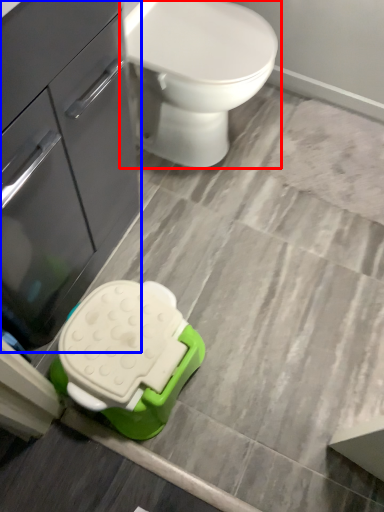
Question: Which object appears farthest to the camera in this image, toilet (highlighted by a red box) or bathroom cabinet (highlighted by a blue box)?

Choices:
 (A) toilet
 (B) bathroom cabinet

Answer: (A)